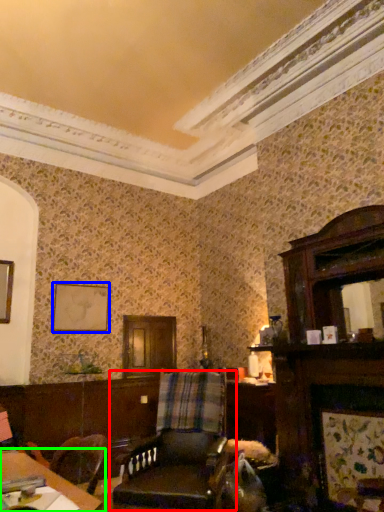
Question: Which is nearer to the chair (highlighted by a red box)? picture frame (highlighted by a blue box) or table (highlighted by a green box).

Choices:
 (A) picture frame
 (B) table

Answer: (B)